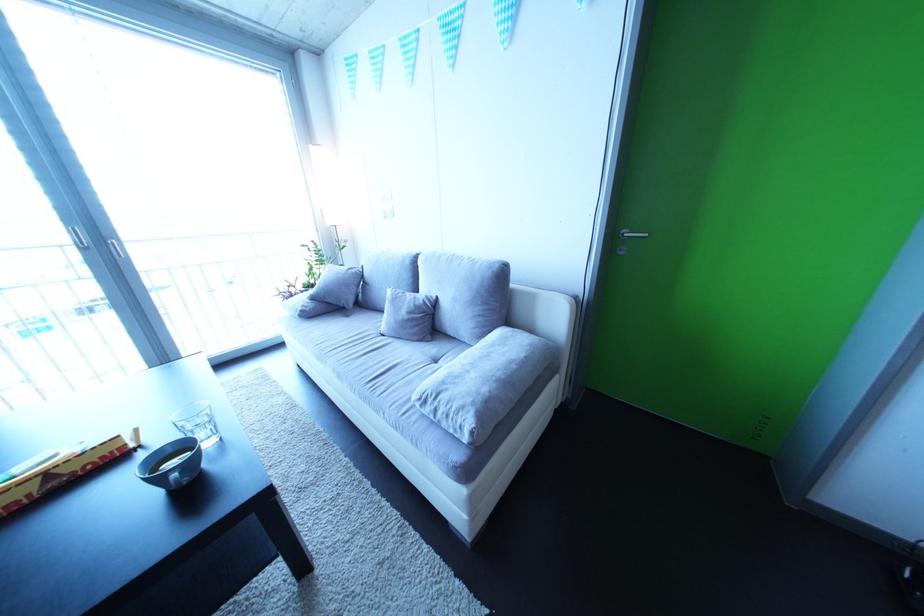
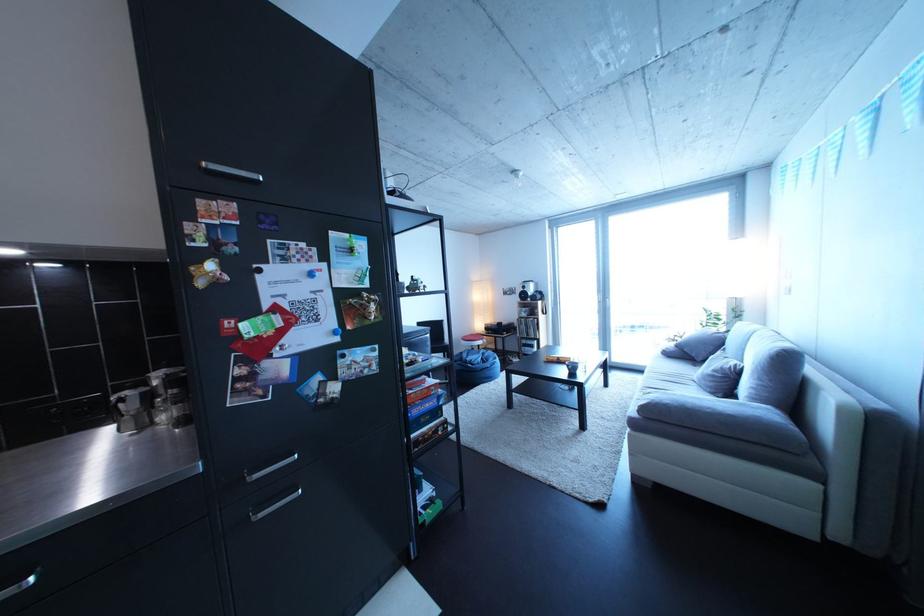
The point at (422,318) is marked in the first image. Where is the corresponding point in the second image?

(727, 377)